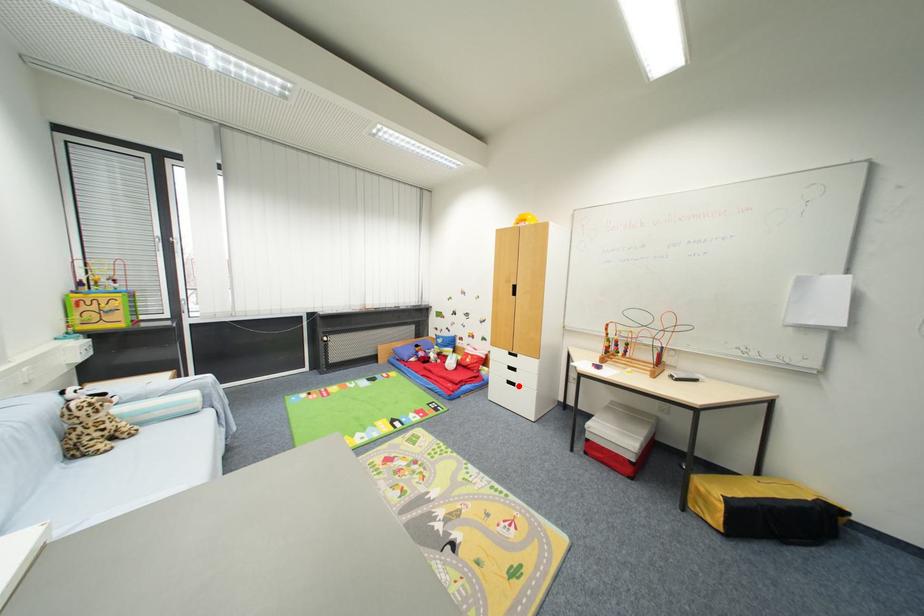
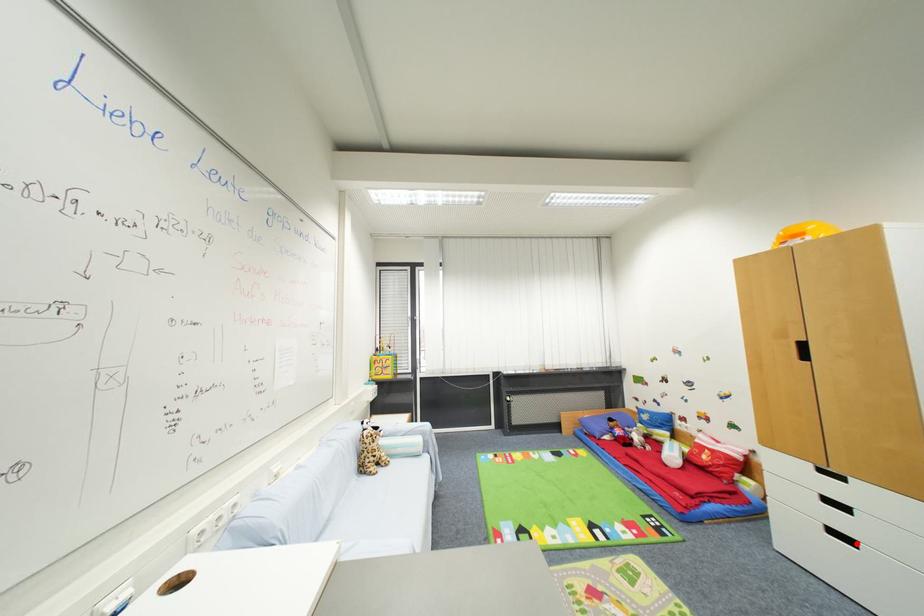
I am providing you with two images of the same scene from different viewpoints. A red point is marked on the first image and another point is marked on the second image. Is the marked point in image1 the same physical position as the marked point in image2?

Yes